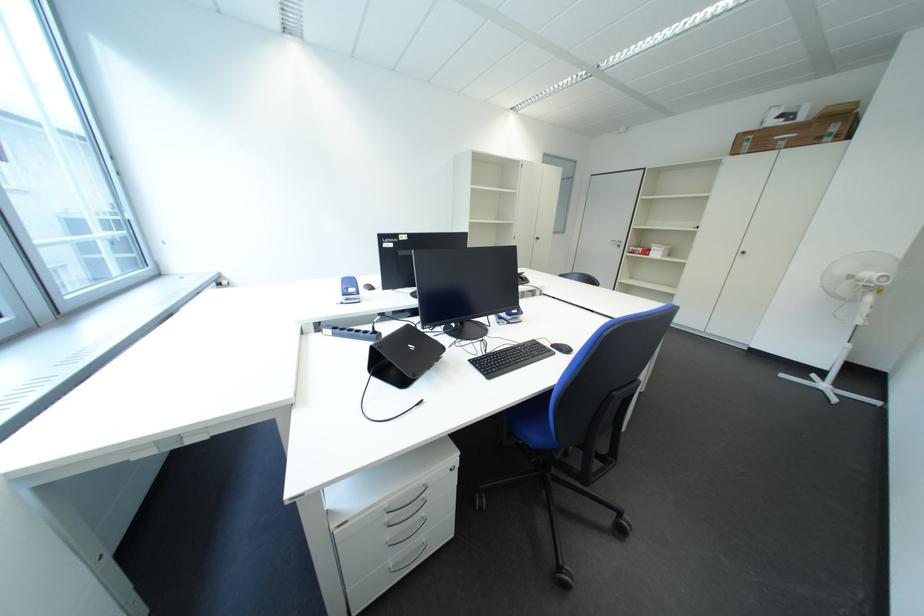
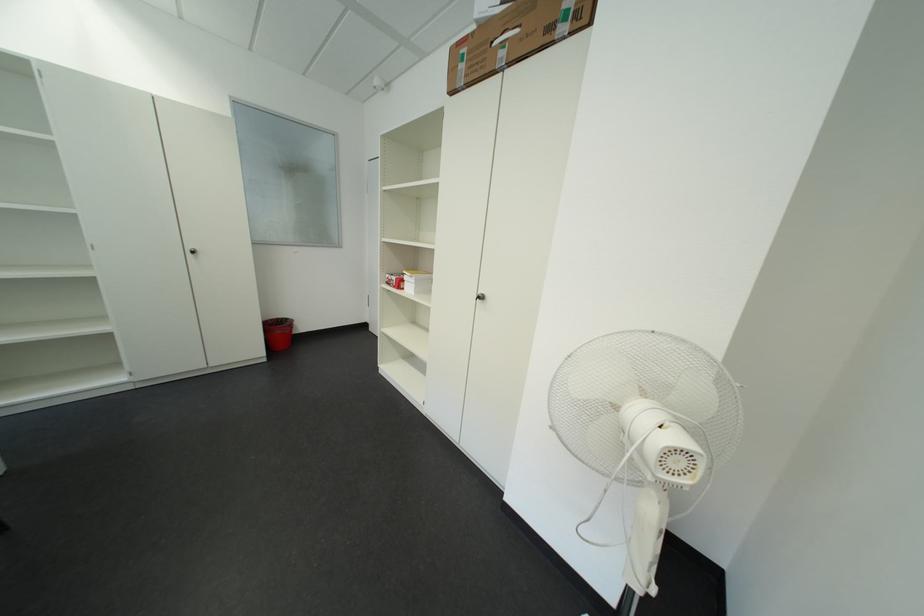
The point at (659, 254) is marked in the first image. Where is the corresponding point in the second image?

(411, 286)